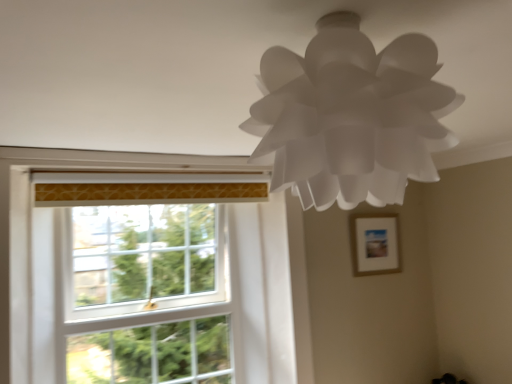
Image resolution: width=512 pixels, height=384 pixels. What do you see at coordinates (351, 116) in the screenshot?
I see `white paper lamp at upper center` at bounding box center [351, 116].

Identify the location of white paper lamp at upper center. (351, 116).

Could you tell me if white glass window screen at left is facing wooden picture frame at upper right?

No, white glass window screen at left is not aimed at wooden picture frame at upper right.

Which point is more distant from viewer, (x=76, y=229) or (x=373, y=252)?

The point (x=373, y=252) is more distant.

You are a GUI agent. You are given a task and a screenshot of the screen. Output one action in this format:
    pyautogui.click(x=<x>, y=<y>)
    Task: Click on the picture frame that appears on the right of white glass window screen at left
    The height and width of the screenshot is (384, 512).
    Given the screenshot: What is the action you would take?
    pyautogui.click(x=375, y=244)

Based on the photo, is wooden picture frame at upper right a part of white glass window screen at left?

No, wooden picture frame at upper right is not a part of white glass window screen at left.

Identify the location of picture frame on the right of white paper lamp at upper center. (375, 244).

Between wooden picture frame at upper right and white paper lamp at upper center, which one has larger size?

white paper lamp at upper center is bigger.

Does wooden picture frame at upper right come behind white paper lamp at upper center?

Yes, wooden picture frame at upper right is further from the viewer.

Would you say wooden picture frame at upper right is inside or outside white paper lamp at upper center?

wooden picture frame at upper right is not inside white paper lamp at upper center, it's outside.

What are the coordinates of `window screen on the left side of white paper lamp at upper center` in the screenshot? It's located at (144, 257).

Considering the sizes of objects white paper lamp at upper center and white glass window screen at left in the image provided, who is smaller, white paper lamp at upper center or white glass window screen at left?

Smaller between the two is white paper lamp at upper center.

Where is `picture frame below the white paper lamp at upper center (from the image's perspective)`? picture frame below the white paper lamp at upper center (from the image's perspective) is located at coordinates (375, 244).

Is white paper lamp at upper center outside of wooden picture frame at upper right?

white paper lamp at upper center is positioned outside wooden picture frame at upper right.

Consider the image. Can you confirm if white paper lamp at upper center is bigger than wooden picture frame at upper right?

Indeed, white paper lamp at upper center has a larger size compared to wooden picture frame at upper right.

Considering the sizes of objects white paper lamp at upper center and wooden picture frame at upper right in the image provided, who is thinner, white paper lamp at upper center or wooden picture frame at upper right?

wooden picture frame at upper right is thinner.

From the picture: Between wooden picture frame at upper right and white glass window screen at left, which one has larger width?

Wider between the two is white glass window screen at left.

Looking at this image, how different are the orientations of wooden picture frame at upper right and white glass window screen at left in degrees?

The facing directions of wooden picture frame at upper right and white glass window screen at left are 1.43 degrees apart.

Is wooden picture frame at upper right beside white glass window screen at left?

No, wooden picture frame at upper right is not with white glass window screen at left.

From the image's perspective, is wooden picture frame at upper right on white glass window screen at left?

Indeed, from the image's perspective, wooden picture frame at upper right is shown above white glass window screen at left.

Between white glass window screen at left and white paper lamp at upper center, which one has larger width?

With larger width is white paper lamp at upper center.

Is white glass window screen at left aimed at white paper lamp at upper center?

Yes, white glass window screen at left is facing white paper lamp at upper center.

Is white glass window screen at left not close to white paper lamp at upper center?

Yes, white glass window screen at left is far from white paper lamp at upper center.

From the picture: Visually, is white glass window screen at left positioned to the left or to the right of white paper lamp at upper center?

Based on their positions, white glass window screen at left is located to the left of white paper lamp at upper center.

This screenshot has height=384, width=512. I want to click on picture frame located behind the white glass window screen at left, so click(x=375, y=244).

In order to click on picture frame below the white paper lamp at upper center (from a real-world perspective) in this screenshot , I will do (x=375, y=244).

In the scene shown: Considering their positions, is wooden picture frame at upper right positioned further to white glass window screen at left than white paper lamp at upper center?

white paper lamp at upper center.

Looking at the image, which one is located further to white paper lamp at upper center, white glass window screen at left or wooden picture frame at upper right?

wooden picture frame at upper right is further to white paper lamp at upper center.

Based on their spatial positions, is wooden picture frame at upper right or white glass window screen at left further from white paper lamp at upper center?

wooden picture frame at upper right.

Based on their spatial positions, is white paper lamp at upper center or wooden picture frame at upper right closer to white glass window screen at left?

Among the two, wooden picture frame at upper right is located nearer to white glass window screen at left.

Looking at the image, which one is located further to wooden picture frame at upper right, white glass window screen at left or white paper lamp at upper center?

Among the two, white paper lamp at upper center is located further to wooden picture frame at upper right.

Considering their positions, is white paper lamp at upper center positioned further to wooden picture frame at upper right than white glass window screen at left?

white paper lamp at upper center.

The width and height of the screenshot is (512, 384). Identify the location of window screen between white paper lamp at upper center and wooden picture frame at upper right in the front-back direction. (144, 257).